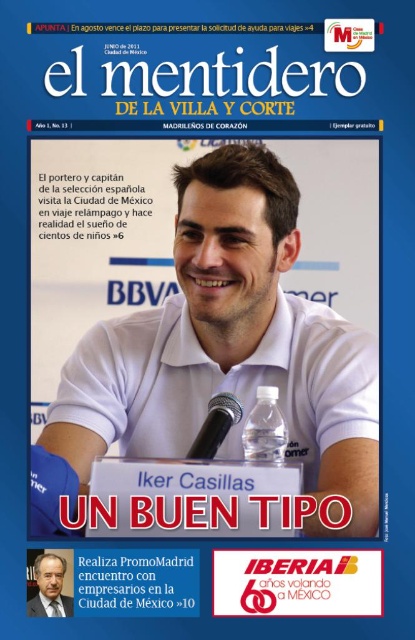
You are a fashion designer observing the magazine cover. You notice two items of clothing at the center of the image. Which one is wider, the white matte polo shirt at center or the matte white shirt at center?

The white matte polo shirt at center might be wider than matte white shirt at center, so it is possible that the white matte polo shirt at center is wider.

Based on the magazine cover described, where is the white matte polo shirt at center located in terms of coordinates?

The white matte polo shirt at center is located at coordinates point [229,390].

You are a photographer who needs to adjust the lighting for the man in the magazine cover photo. You notice the clear plastic water bottle at center and the black plastic microphone at center. Which object is positioned lower in the image?

The clear plastic water bottle at center is positioned lower than the black plastic microphone at center.